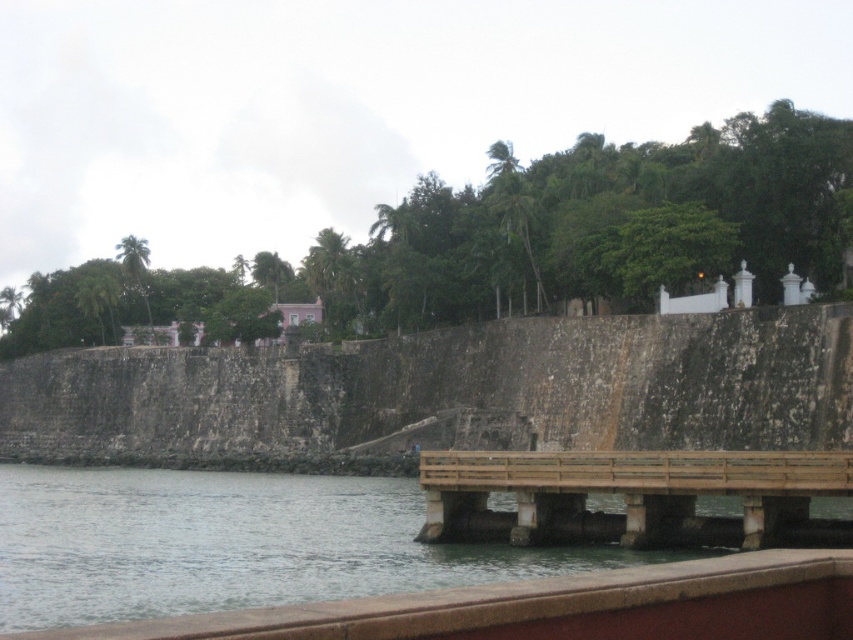
Question: Is clear water at lower left to the left of brown wooden dock at lower center from the viewer's perspective?

Choices:
 (A) no
 (B) yes

Answer: (B)

Question: Does clear water at lower left have a lesser width compared to brown wooden dock at lower center?

Choices:
 (A) no
 (B) yes

Answer: (A)

Question: Which of the following is the closest to the observer?

Choices:
 (A) (560, 570)
 (B) (653, 512)

Answer: (A)

Question: Can you confirm if clear water at lower left is positioned above brown wooden dock at lower center?

Choices:
 (A) no
 (B) yes

Answer: (A)

Question: Which object is farther from the camera taking this photo?

Choices:
 (A) brown wooden dock at lower center
 (B) clear water at lower left

Answer: (A)